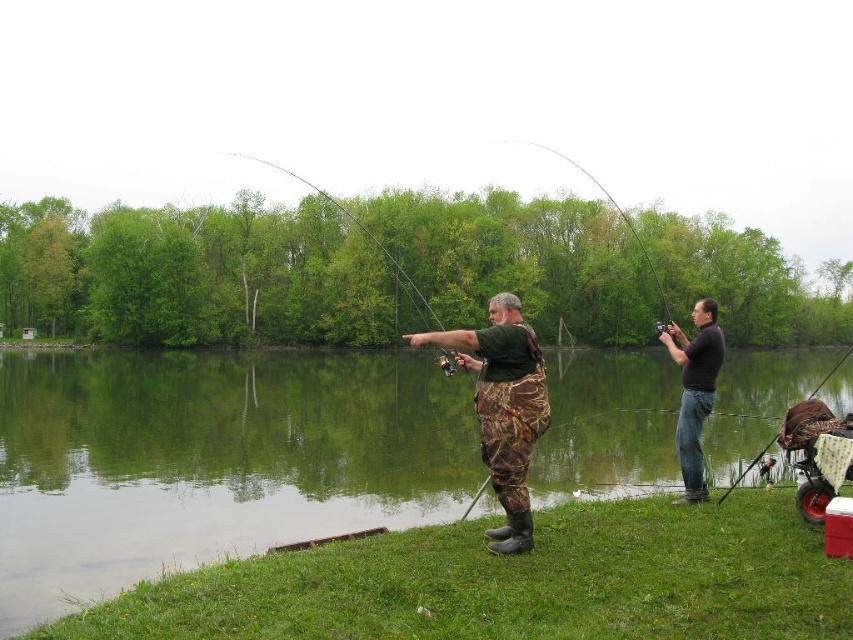
You are a photographer standing at the edge of the lake. You want to take a photo of the camouflage pants at center. Where should you position your camera to capture the best shot?

The camouflage pants at center is located at point 2D coordinates (503,406), so you should position your camera to aim directly at that point to capture the best shot.

You are a fisherman standing on the lakeside and want to cast your line into the green smooth water at center. Your current position is where the camouflage pants at center are located. Can you reach the water without moving? Explain your reasoning based on the distance provided.

The distance between the green smooth water at center and the camouflage pants at center is 35.61 meters. Since this distance is quite large, you would need to move closer to the water to cast your line effectively. Standing at the current position of the camouflage pants at center, you cannot reach the water without moving.

You are a photographer trying to capture both the shiny metallic rod at upper center and the matte black fishing pole at right in the same frame. Based on their positions, which object should you adjust your camera to focus on first to ensure both are in the frame?

Since the shiny metallic rod at upper center is to the right of the matte black fishing pole at right, you should focus on the matte black fishing pole at right first. This way, you can adjust your camera to include both objects by expanding the frame to the left.